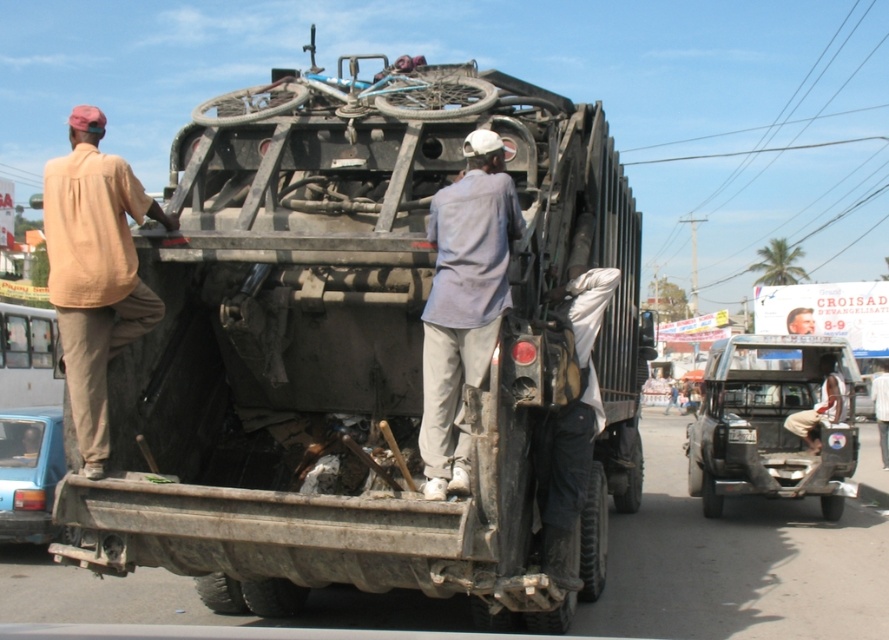
Question: Which object appears closest to the camera in this image?

Choices:
 (A) light blue fabric shirt at center
 (B) rusty metal garbage truck at center
 (C) beige fabric shirt at upper left
 (D) light brown fabric shirt at center

Answer: (B)

Question: Does rusty metal garbage truck at center have a smaller size compared to black leather pants at lower center?

Choices:
 (A) yes
 (B) no

Answer: (B)

Question: Is metallic silver truck at center behind matte blue car at left?

Choices:
 (A) no
 (B) yes

Answer: (B)

Question: Among these points, which one is farthest from the camera?

Choices:
 (A) (329, 284)
 (B) (870, 396)
 (C) (119, 275)

Answer: (B)

Question: Which of the following is the closest to the observer?

Choices:
 (A) beige fabric shirt at upper left
 (B) matte blue car at left

Answer: (A)

Question: In this image, where is rusty metal garbage truck at center located relative to black leather pants at lower center?

Choices:
 (A) left
 (B) right

Answer: (A)